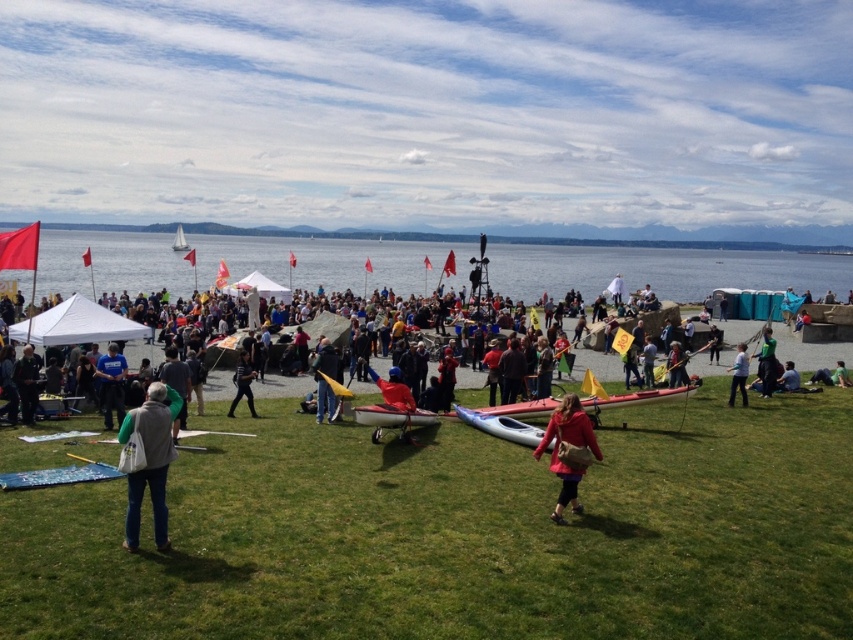
Is point (108, 289) positioned in front of point (577, 444)?

That is False.

Which is in front, point (171, 262) or point (593, 444)?

Point (593, 444) is in front.

Which is in front, point (469, 264) or point (582, 467)?

Point (582, 467) is more forward.

Locate an element on the screen. The width and height of the screenshot is (853, 640). clear blue water at center is located at coordinates (659, 269).

I want to click on denim jacket at lower left, so click(149, 461).

In the scene shown: Is denim jacket at lower left further to camera compared to orange fabric kayak at center?

No, it is in front of orange fabric kayak at center.

Does point (126, 513) come farther from viewer compared to point (334, 404)?

That is False.

Identify the location of denim jacket at lower left. This screenshot has height=640, width=853. (149, 461).

Is denim jacket at lower left bigger than dark blue jeans at center?

Yes, denim jacket at lower left is bigger than dark blue jeans at center.

Which is below, denim jacket at lower left or dark blue jeans at center?

denim jacket at lower left is below.

I want to click on denim jacket at lower left, so click(149, 461).

The image size is (853, 640). I want to click on denim jacket at lower left, so click(x=149, y=461).